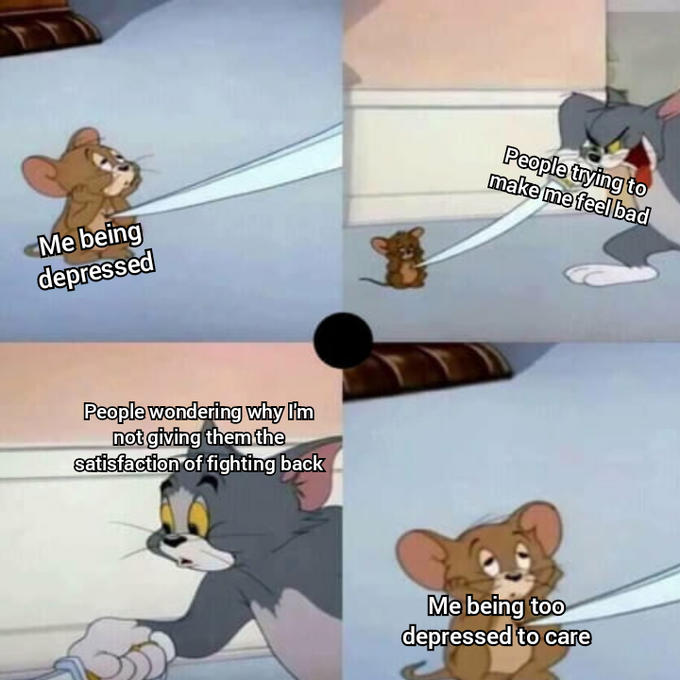
Locate an element on the screen. mouse is located at coordinates (109, 214), (491, 568), (411, 239).